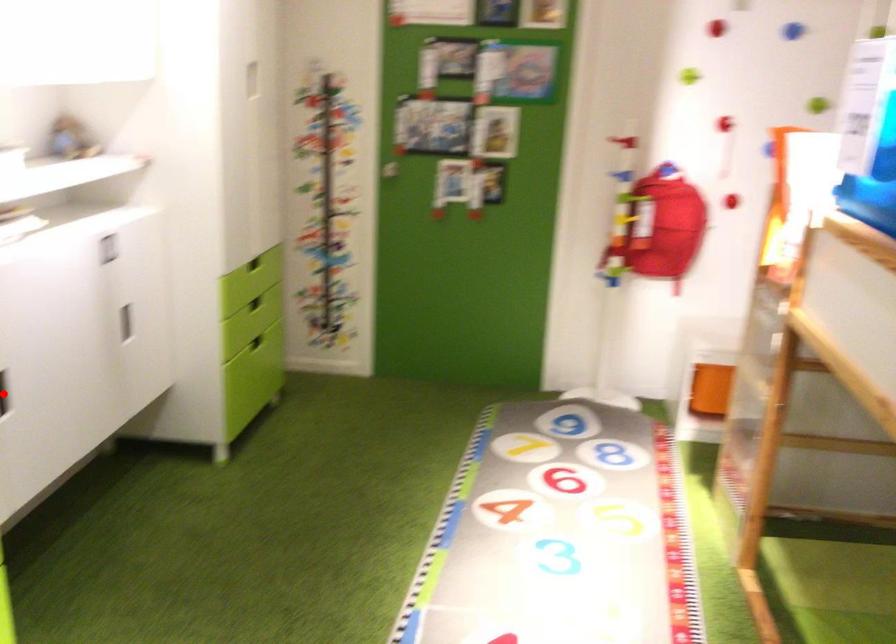
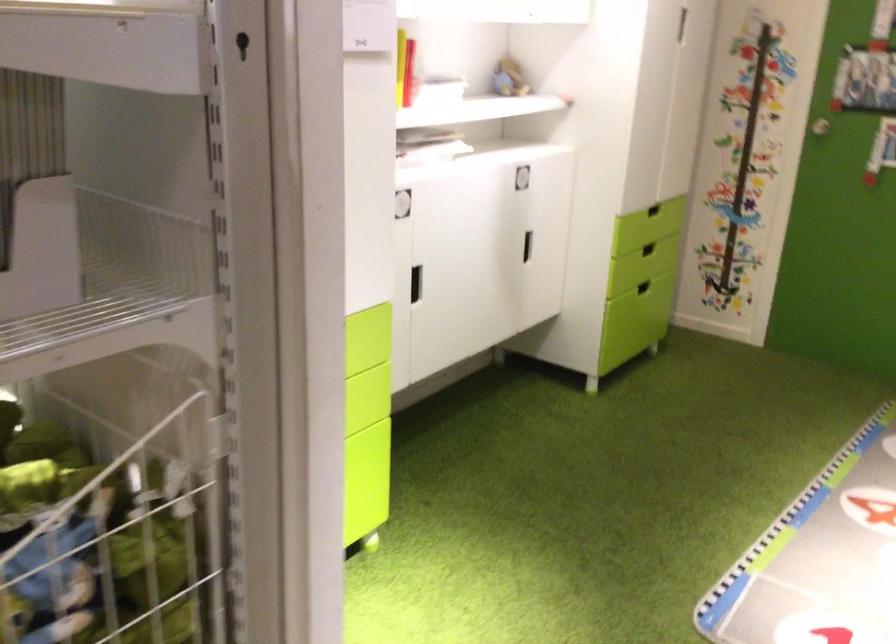
Question: I am providing you with two images of the same scene from different viewpoints. A red point is marked on the first image. Can you still see the location of the red point in image 2?

Choices:
 (A) Yes
 (B) No

Answer: (B)